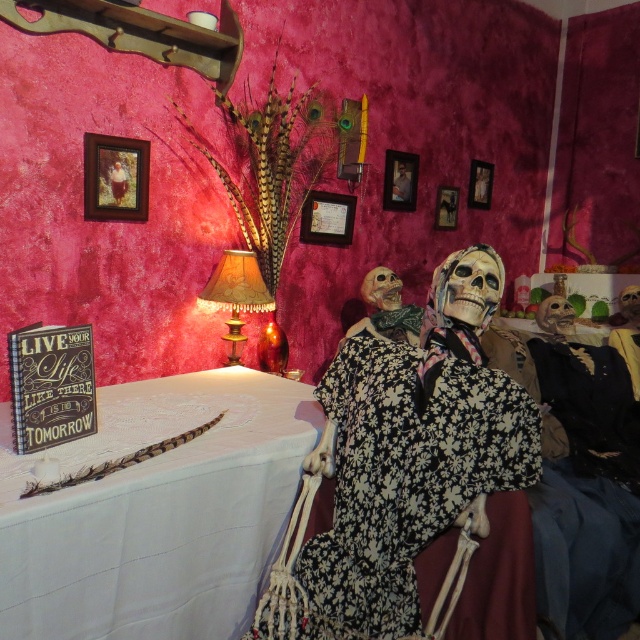
You are an interior designer planning to hang a new decoration between the leather textured lampshade at center and the smooth wooden frame at upper center. Considering their sizes, which object should you place closer to the center to maintain balance?

The leather textured lampshade at center is larger in size than the smooth wooden frame at upper center, so to maintain balance, you should place the smaller smooth wooden frame at upper center closer to the center.

You are a guest at this festive event and want to place a small candle on the table. The candle requires a space that is at least 10 cm tall to stand properly. Can the white lace tablecloth at upper left or the smooth wooden frame at upper center provide enough height for the candle?

The white lace tablecloth at upper left is taller than the smooth wooden frame at upper center. Therefore, the white lace tablecloth at upper left can provide enough height for the candle as it meets the minimum 10 cm requirement.

You are an interior designer examining the vibrant interior scene. You notice the leather textured lampshade at center and the smooth wooden frame at upper center. Based on their positions, which object is closer to the left side of the image?

The leather textured lampshade at center is closer to the left side of the image because it is positioned to the left of the smooth wooden frame at upper center.